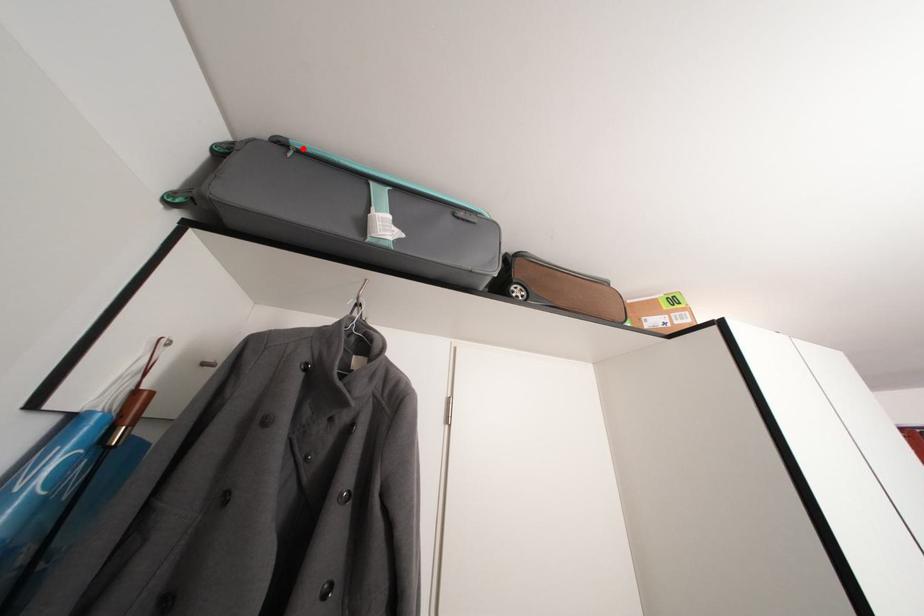
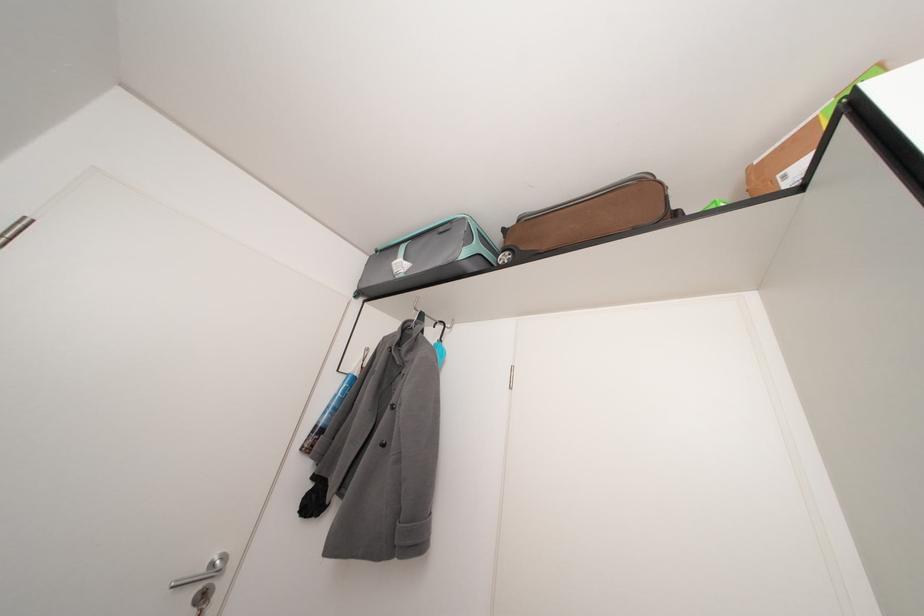
Find the pixel in the second image that matches the highlighted location in the first image.

(386, 254)